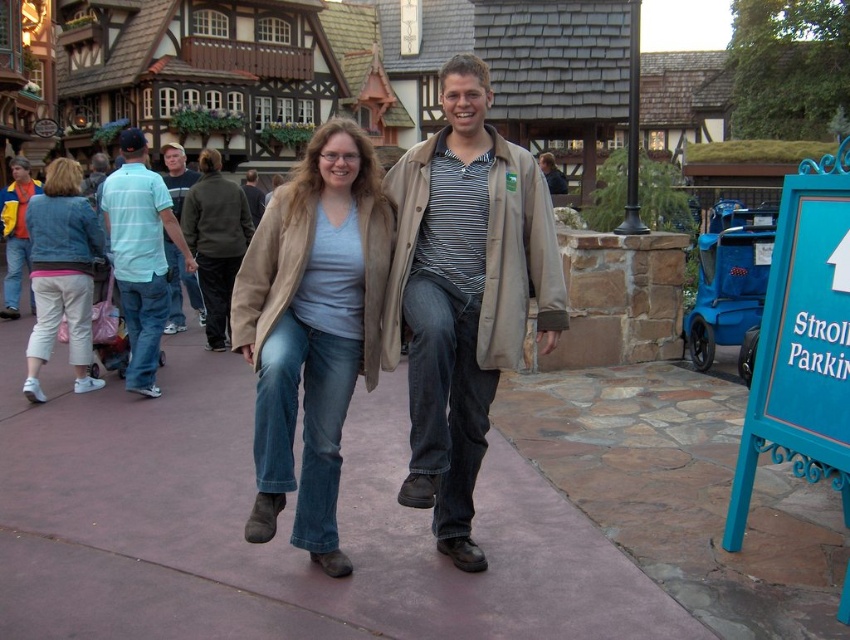
Does beige fabric coat at center come behind blue painted wood sign at lower right?

Yes, beige fabric coat at center is further from the viewer.

Does beige fabric coat at center have a smaller size compared to blue painted wood sign at lower right?

No, beige fabric coat at center is not smaller than blue painted wood sign at lower right.

You are a GUI agent. You are given a task and a screenshot of the screen. Output one action in this format:
    pyautogui.click(x=<x>, y=<y>)
    Task: Click on the beige fabric coat at center
    This screenshot has width=850, height=640.
    Given the screenshot: What is the action you would take?
    pyautogui.click(x=463, y=292)

Looking at this image, is light blue denim jeans at center below light blue striped polo shirt at left?

Correct, light blue denim jeans at center is located below light blue striped polo shirt at left.

Can you confirm if light blue denim jeans at center is wider than light blue striped polo shirt at left?

In fact, light blue denim jeans at center might be narrower than light blue striped polo shirt at left.

The image size is (850, 640). What do you see at coordinates (312, 328) in the screenshot? I see `light blue denim jeans at center` at bounding box center [312, 328].

Locate an element on the screen. The height and width of the screenshot is (640, 850). light blue denim jeans at center is located at coordinates (312, 328).

Can you confirm if pink concrete sidewalk at center is positioned to the right of denim pants at left?

Correct, you'll find pink concrete sidewalk at center to the right of denim pants at left.

Consider the image. Does pink concrete sidewalk at center have a greater width compared to denim pants at left?

Correct, the width of pink concrete sidewalk at center exceeds that of denim pants at left.

Does point (525, 547) lie behind point (38, 385)?

That is False.

Find the location of a particular element. pink concrete sidewalk at center is located at coordinates (278, 529).